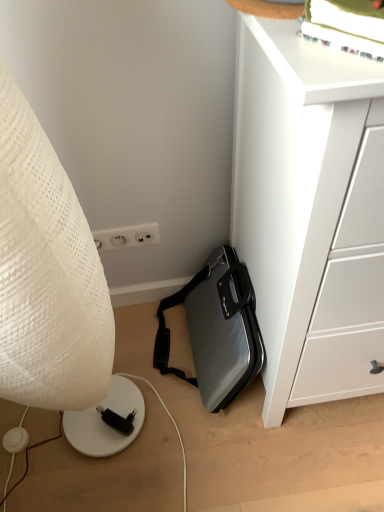
The image size is (384, 512). Find the location of `vacant space underneath white textured lamp at left (from a real-world perspective)`. vacant space underneath white textured lamp at left (from a real-world perspective) is located at coordinates (92, 456).